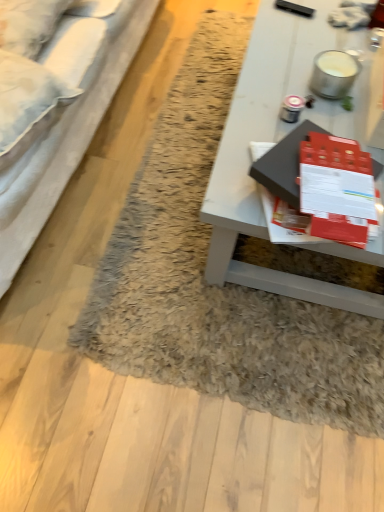
Identify the location of free space above matte black book at center (from a real-world perspective). (329, 174).